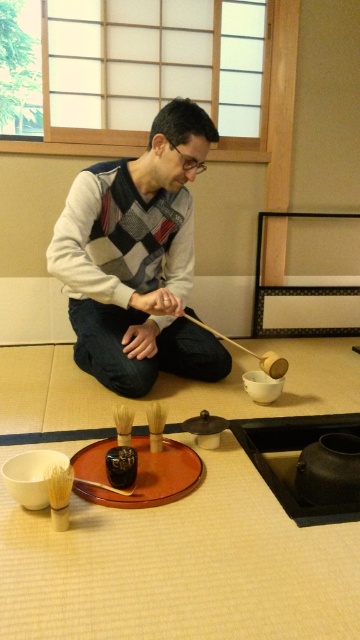
You are a photographer taking a picture of the tea ceremony setup. You need to ensure that the knit sweater at center and the brown wooden tray at center are both in focus. Based on their positions, which one should you focus on first to ensure both are sharp?

The knit sweater at center is above the brown wooden tray at center, so focusing on the sweater first will help ensure both are in focus since it is closer to the camera.

What is the 2D coordinate of the knit sweater at center?

The 2D coordinate of the knit sweater at center is at point (137, 259).

You are observing a traditional Japanese tea ceremony. There are two points marked in the scene. The first point is at coordinates point (140,380), and the second is at point (91,445). From your perspective, which point is closer to you?

Point (91,445) is closer to you because it is in front of point (140,380).